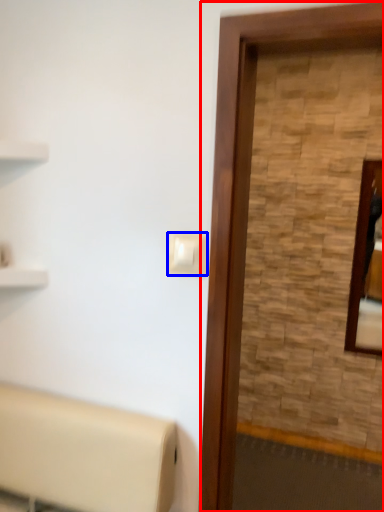
Question: Which object appears closest to the camera in this image, screen door (highlighted by a red box) or light switch (highlighted by a blue box)?

Choices:
 (A) screen door
 (B) light switch

Answer: (A)